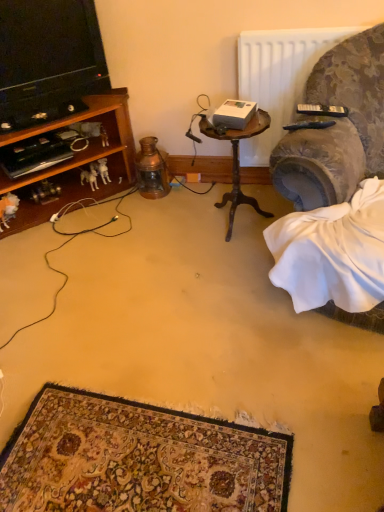
Identify the location of blank space to the left of white fabric at lower right. Image resolution: width=384 pixels, height=512 pixels. (204, 303).